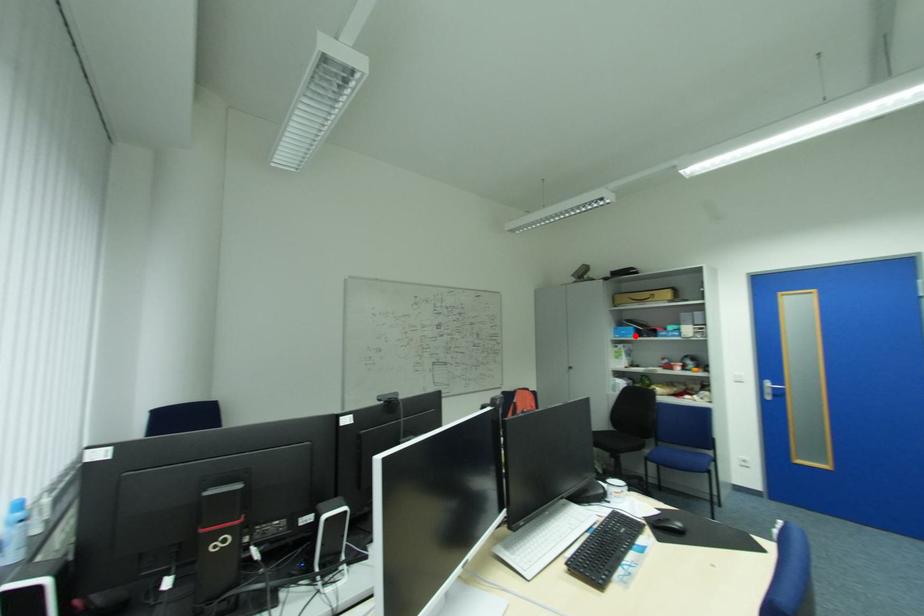
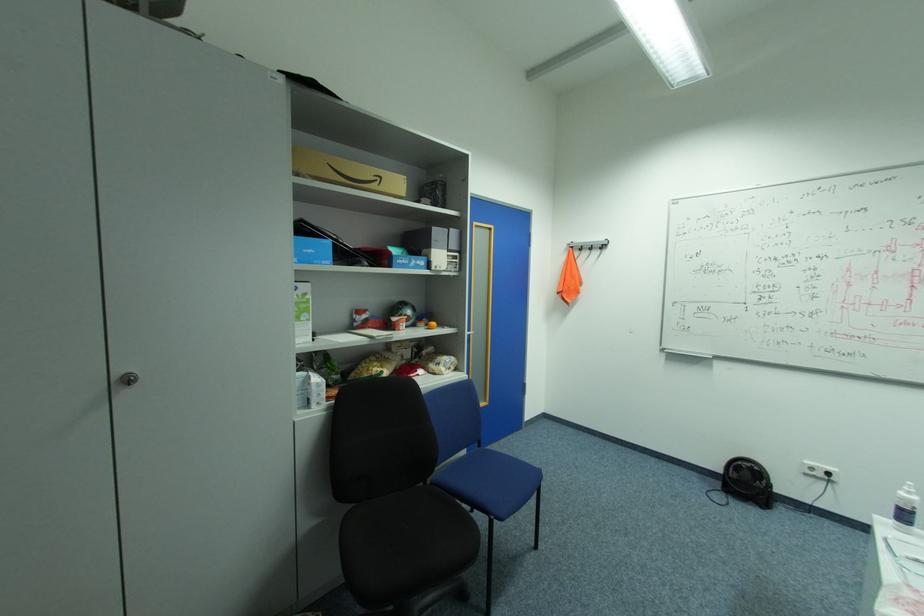
In the second image, find the point that corresponds to the highlighted location in the first image.

(331, 262)